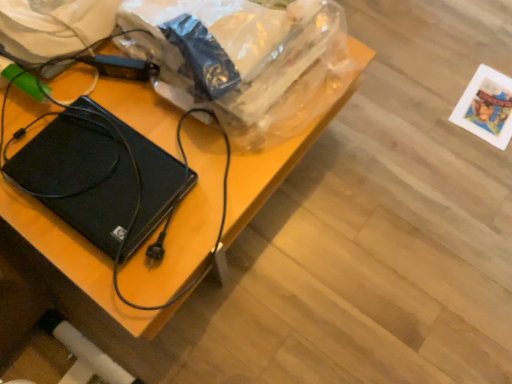
Question: Would you say black plastic hard drive at center is outside black matte laptop at left?

Choices:
 (A) yes
 (B) no

Answer: (A)

Question: From the image's perspective, is black plastic hard drive at center located beneath black matte laptop at left?

Choices:
 (A) no
 (B) yes

Answer: (A)

Question: Are black plastic hard drive at center and black matte laptop at left far apart?

Choices:
 (A) yes
 (B) no

Answer: (B)

Question: Can you confirm if black plastic hard drive at center is positioned to the left of black matte laptop at left?

Choices:
 (A) yes
 (B) no

Answer: (B)

Question: Is black plastic hard drive at center wider than black matte laptop at left?

Choices:
 (A) yes
 (B) no

Answer: (A)

Question: Is plastic bag at upper center in front of or behind black matte laptop at left in the image?

Choices:
 (A) behind
 (B) front

Answer: (B)

Question: Is point (275, 137) positioned closer to the camera than point (37, 193)?

Choices:
 (A) closer
 (B) farther

Answer: (B)

Question: Based on their positions, is plastic bag at upper center located to the left or right of black matte laptop at left?

Choices:
 (A) left
 (B) right

Answer: (B)

Question: From a real-world perspective, relative to black matte laptop at left, is plastic bag at upper center vertically above or below?

Choices:
 (A) below
 (B) above

Answer: (B)

Question: In terms of width, does black plastic hard drive at center look wider or thinner when compared to plastic bag at upper center?

Choices:
 (A) thin
 (B) wide

Answer: (B)

Question: Would you say black plastic hard drive at center is inside or outside plastic bag at upper center?

Choices:
 (A) outside
 (B) inside

Answer: (A)

Question: In terms of size, does black plastic hard drive at center appear bigger or smaller than plastic bag at upper center?

Choices:
 (A) small
 (B) big

Answer: (B)

Question: From a real-world perspective, is black plastic hard drive at center physically located above or below plastic bag at upper center?

Choices:
 (A) above
 (B) below

Answer: (B)

Question: In terms of height, does black matte laptop at left look taller or shorter compared to plastic bag at upper center?

Choices:
 (A) short
 (B) tall

Answer: (A)

Question: Considering the positions of point (143, 155) and point (236, 21), is point (143, 155) closer or farther from the camera than point (236, 21)?

Choices:
 (A) farther
 (B) closer

Answer: (A)